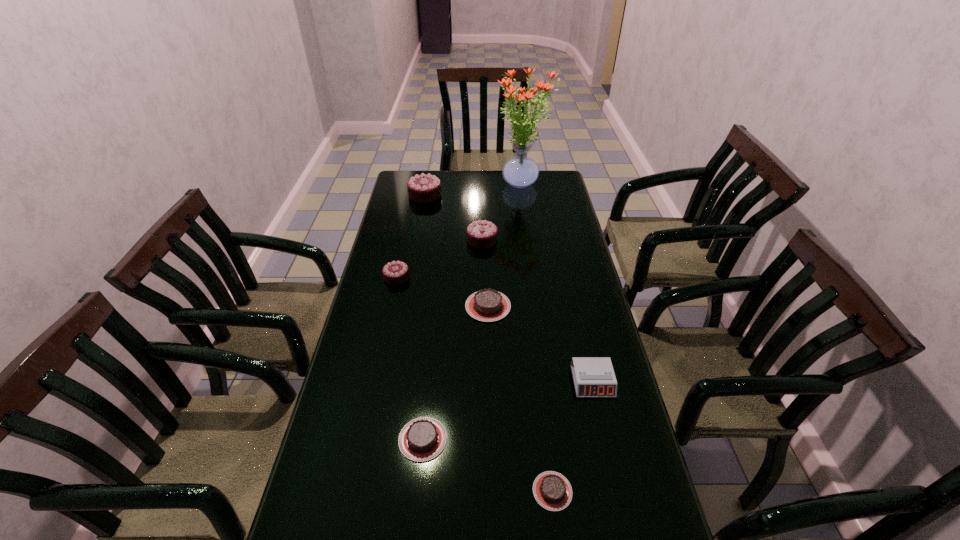
The height and width of the screenshot is (540, 960). Find the location of `the biggest brown chocolate cake`. the biggest brown chocolate cake is located at coordinates (488, 305).

The width and height of the screenshot is (960, 540). Find the location of `the fifth farthest chocolate cake`. the fifth farthest chocolate cake is located at coordinates (422, 439).

You are a GUI agent. You are given a task and a screenshot of the screen. Output one action in this format:
    pyautogui.click(x=<x>, y=<y>)
    Task: Click on the second biggest brown chocolate cake
    Image resolution: width=960 pixels, height=540 pixels.
    Given the screenshot: What is the action you would take?
    pyautogui.click(x=422, y=439)

This screenshot has height=540, width=960. I want to click on the smallest brown chocolate cake, so click(x=552, y=491).

Where is `the rightmost chocolate cake`? the rightmost chocolate cake is located at coordinates (552, 491).

The image size is (960, 540). Identify the location of vacant space located 0.250m on the left of the red flower arrangement. (442, 184).

The width and height of the screenshot is (960, 540). I want to click on vacant area situated 0.050m on the front of the farthest chocolate chocolate cake, so click(422, 210).

Where is `free location located 0.380m on the back of the second farthest chocolate cake`? This screenshot has height=540, width=960. free location located 0.380m on the back of the second farthest chocolate cake is located at coordinates (482, 184).

Find the location of a particular element. free space located 0.290m on the back of the nearest chocolate chocolate cake is located at coordinates (408, 224).

The image size is (960, 540). I want to click on vacant position located 0.290m on the front of the third nearest object, so click(622, 511).